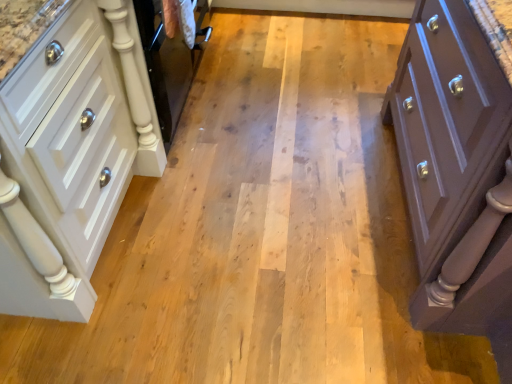
Question: Is white glossy cabinet at left, which is the 1th chest of drawers in left-to-right order, oriented towards matte purple chest of drawers at right, which ranks as the first chest of drawers in right-to-left order?

Choices:
 (A) no
 (B) yes

Answer: (B)

Question: Would you say white glossy cabinet at left, which is the 1th chest of drawers in left-to-right order, is a long distance from matte purple chest of drawers at right, which ranks as the first chest of drawers in right-to-left order?

Choices:
 (A) no
 (B) yes

Answer: (B)

Question: From a real-world perspective, does white glossy cabinet at left, the 2th chest of drawers when ordered from right to left, stand above matte purple chest of drawers at right, marked as the 2th chest of drawers in a left-to-right arrangement?

Choices:
 (A) yes
 (B) no

Answer: (B)

Question: Does white glossy cabinet at left, which is the 1th chest of drawers in left-to-right order, have a greater width compared to matte purple chest of drawers at right, which ranks as the first chest of drawers in right-to-left order?

Choices:
 (A) no
 (B) yes

Answer: (A)

Question: Would you say matte purple chest of drawers at right, which ranks as the first chest of drawers in right-to-left order, is part of white glossy cabinet at left, the 2th chest of drawers when ordered from right to left,'s contents?

Choices:
 (A) no
 (B) yes

Answer: (A)

Question: From the image's perspective, is white glossy cabinet at left, the 2th chest of drawers when ordered from right to left, located above matte purple chest of drawers at right, marked as the 2th chest of drawers in a left-to-right arrangement?

Choices:
 (A) no
 (B) yes

Answer: (B)

Question: Can you confirm if matte purple chest of drawers at right, marked as the 2th chest of drawers in a left-to-right arrangement, is smaller than white glossy cabinet at left, which is the 1th chest of drawers in left-to-right order?

Choices:
 (A) no
 (B) yes

Answer: (A)

Question: Can you confirm if matte purple chest of drawers at right, which ranks as the first chest of drawers in right-to-left order, is shorter than white glossy cabinet at left, which is the 1th chest of drawers in left-to-right order?

Choices:
 (A) no
 (B) yes

Answer: (A)

Question: From a real-world perspective, does matte purple chest of drawers at right, marked as the 2th chest of drawers in a left-to-right arrangement, stand above white glossy cabinet at left, which is the 1th chest of drawers in left-to-right order?

Choices:
 (A) no
 (B) yes

Answer: (B)

Question: Can white glossy cabinet at left, which is the 1th chest of drawers in left-to-right order, be found inside matte purple chest of drawers at right, which ranks as the first chest of drawers in right-to-left order?

Choices:
 (A) yes
 (B) no

Answer: (B)

Question: From the image's perspective, is matte purple chest of drawers at right, marked as the 2th chest of drawers in a left-to-right arrangement, beneath white glossy cabinet at left, which is the 1th chest of drawers in left-to-right order?

Choices:
 (A) yes
 (B) no

Answer: (A)

Question: Is matte purple chest of drawers at right, marked as the 2th chest of drawers in a left-to-right arrangement, looking in the opposite direction of white glossy cabinet at left, the 2th chest of drawers when ordered from right to left?

Choices:
 (A) yes
 (B) no

Answer: (B)

Question: In the image, is white glossy cabinet at left, the 2th chest of drawers when ordered from right to left, positioned in front of or behind matte purple chest of drawers at right, which ranks as the first chest of drawers in right-to-left order?

Choices:
 (A) front
 (B) behind

Answer: (B)